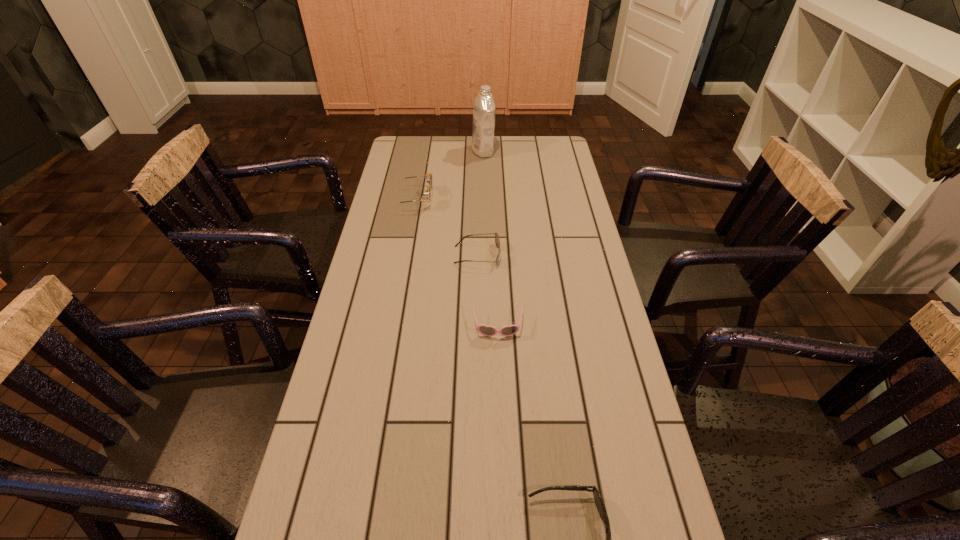
In order to click on the tallest object in this screenshot , I will do `click(482, 144)`.

Find the location of a particular element. the farthest object is located at coordinates (482, 144).

You are a GUI agent. You are given a task and a screenshot of the screen. Output one action in this format:
    pyautogui.click(x=<x>, y=<y>)
    Task: Click on the tallest sunglasses
    The height and width of the screenshot is (540, 960).
    Given the screenshot: What is the action you would take?
    pyautogui.click(x=428, y=177)

Locate an element on the screen. the second tallest object is located at coordinates (428, 177).

Where is `the third nearest sunglasses`? The height and width of the screenshot is (540, 960). the third nearest sunglasses is located at coordinates (497, 241).

Locate an element on the screen. The image size is (960, 540). the third farthest sunglasses is located at coordinates (485, 330).

The image size is (960, 540). In order to click on vacant space located 0.060m on the back of the tallest object in this screenshot , I will do `click(483, 137)`.

I want to click on free space located 0.070m on the front lenses of the second tallest object, so 451,199.

This screenshot has height=540, width=960. Identify the location of free space located on the front-facing side of the third farthest object. (525, 255).

This screenshot has height=540, width=960. What are the coordinates of `vacant region located 0.130m on the front-facing side of the second nearest sunglasses` in the screenshot? It's located at (499, 383).